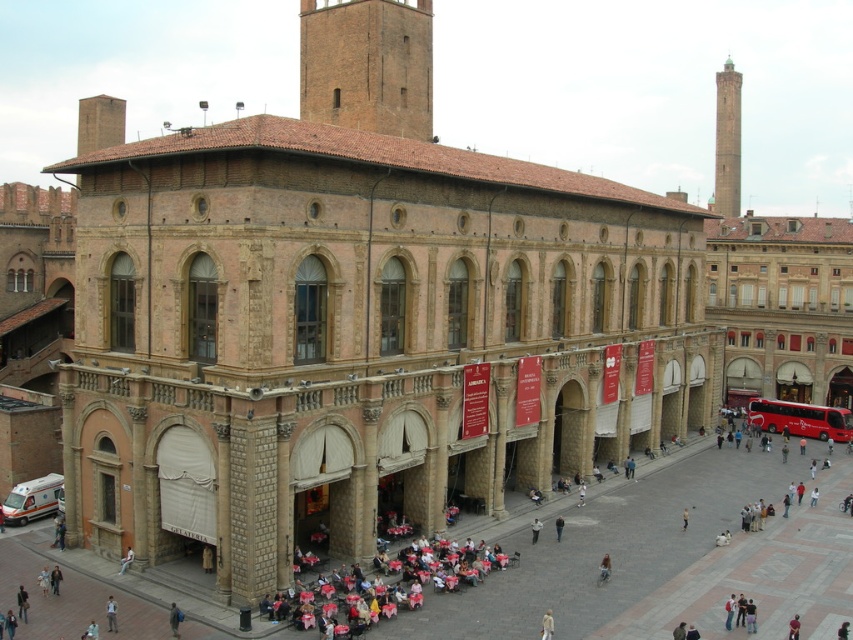
Question: Which point is closer to the camera taking this photo?

Choices:
 (A) (337, 61)
 (B) (128, 557)

Answer: (B)

Question: Is smooth stone tower at upper right thinner than light beige fabric at lower center?

Choices:
 (A) no
 (B) yes

Answer: (A)

Question: Does red metallic bus at lower right have a larger size compared to light beige fabric at lower center?

Choices:
 (A) no
 (B) yes

Answer: (B)

Question: Which point is closer to the camera?

Choices:
 (A) light beige fabric at lower center
 (B) light blue jeans at lower left
 (C) light blue denim jacket at lower center

Answer: (A)

Question: Which object is the closest to the smooth stone tower at upper right?

Choices:
 (A) brick tower at upper center
 (B) red metallic bus at lower right

Answer: (B)

Question: Can you confirm if red metallic bus at lower right is positioned to the right of light beige fabric at lower center?

Choices:
 (A) no
 (B) yes

Answer: (B)